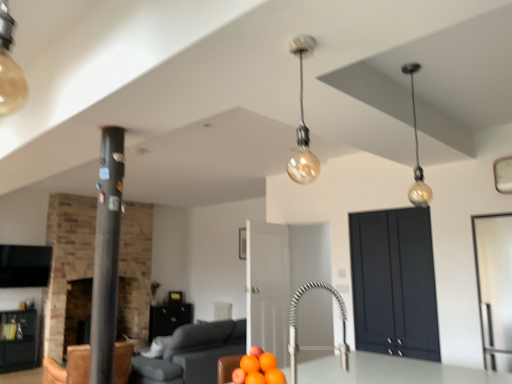
Question: Is point (168, 319) positioned closer to the camera than point (80, 296)?

Choices:
 (A) farther
 (B) closer

Answer: (A)

Question: Would you say matte black cabinet at lower center, which appears as the first cabinetry when ordered from the bottom, is inside or outside brick fireplace at left, the second fireplace positioned from the right?

Choices:
 (A) outside
 (B) inside

Answer: (A)

Question: Estimate the real-world distances between objects in this image. Which object is closer to the leather armchair at lower left?

Choices:
 (A) matte black cabinet at lower center, marked as the third cabinetry in a top-to-bottom arrangement
 (B) translucent glass bulb at center, placed as the second light fixture when sorted from right to left
 (C) orange matte at center
 (D) matte glass bulb at upper right, positioned as the 2th light fixture in front-to-back order
 (E) black matte pillar at left

Answer: (E)

Question: Which object is positioned farthest from the matte gray sofa at lower center?

Choices:
 (A) brick fireplace at left, which appears as the first fireplace when viewed from the left
 (B) leather armchair at lower left
 (C) matte black cabinet at lower center, acting as the first cabinetry starting from the back
 (D) dark matte cabinet at center right, the 3th cabinetry viewed from the left
 (E) translucent glass bulb at center, which appears as the first light fixture when viewed from the front

Answer: (E)